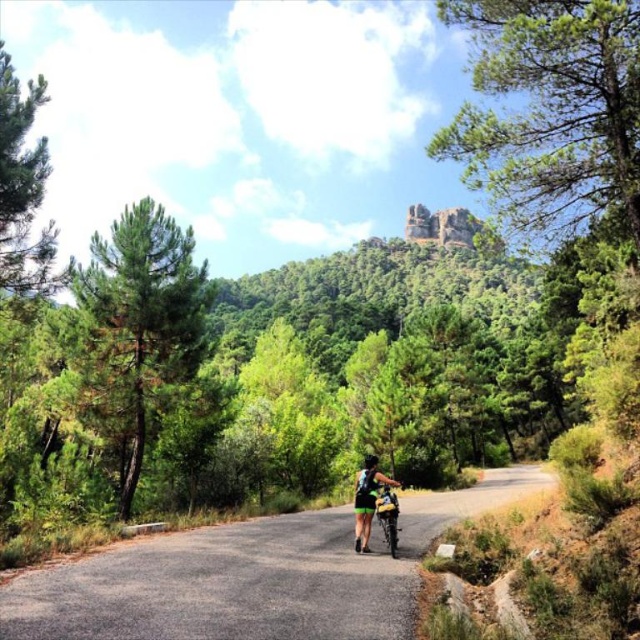
You are a cyclist planning to ride along the gray asphalt road at center. There is a metallic silver bicycle at center in your path. Can you safely pass around the bicycle without leaving the road?

The gray asphalt road at center is bigger than the metallic silver bicycle at center, so yes, you can safely pass around the metallic silver bicycle at center since the road is wider than the bicycle.

You are a cyclist who has stopped to adjust your clothing. Looking down, you see the gray asphalt road at center and the green matte shorts at center. Which one is higher from your viewpoint?

The gray asphalt road at center is above the green matte shorts at center, so the gray asphalt road at center is higher from your viewpoint.